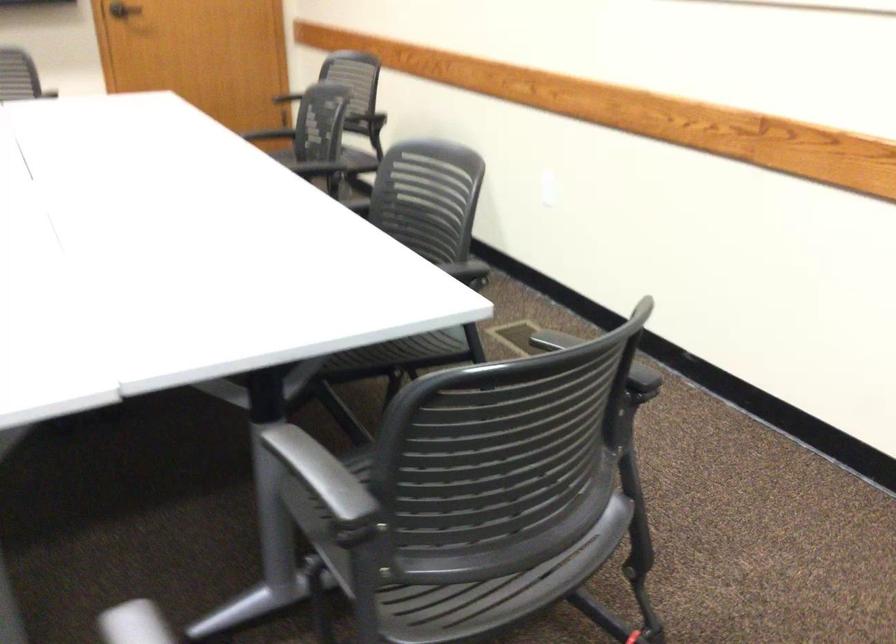
Find where to push the white light switch. Please return your answer as a coordinate pair (x, y).

(547, 196)